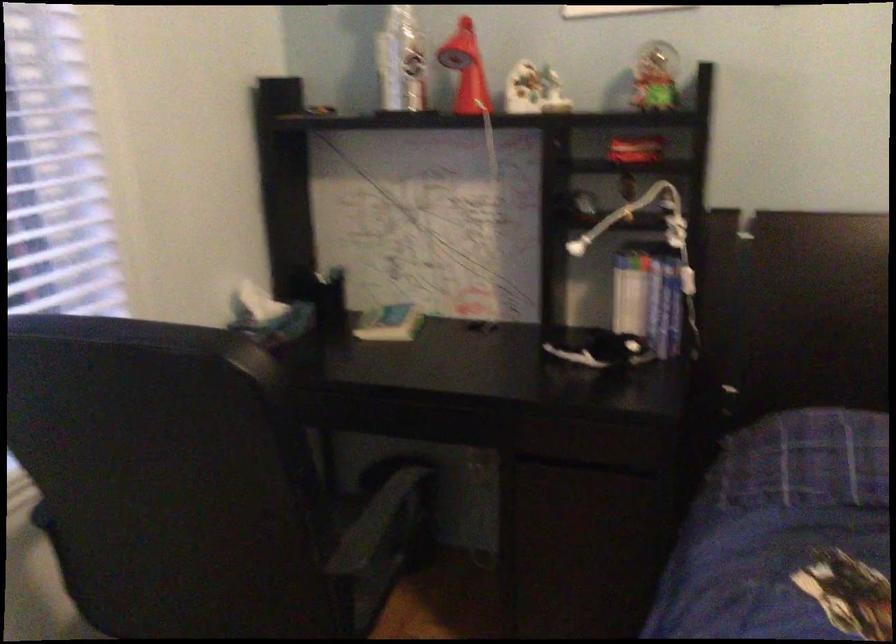
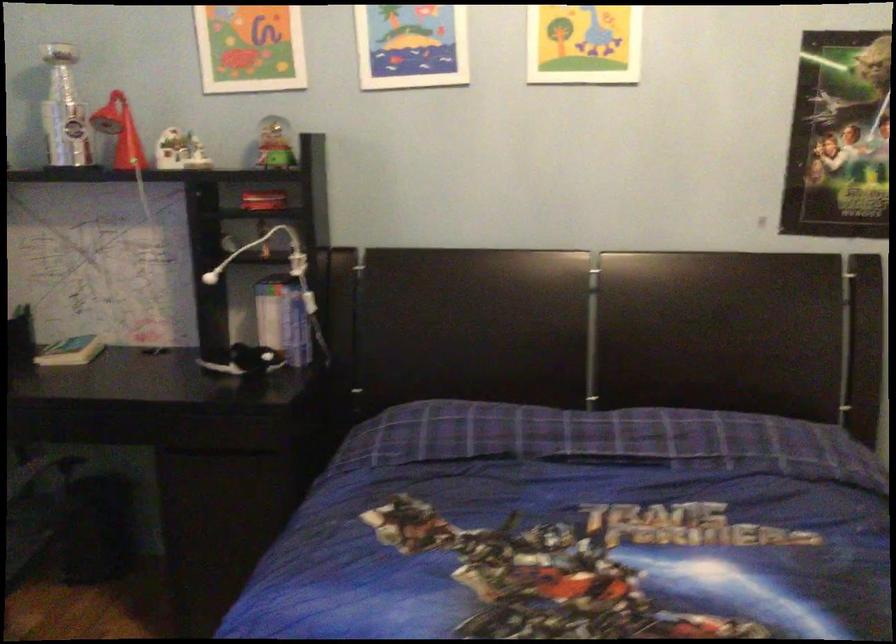
Where in the second image is the point corresponding to pixel 657 304 from the first image?

(288, 321)